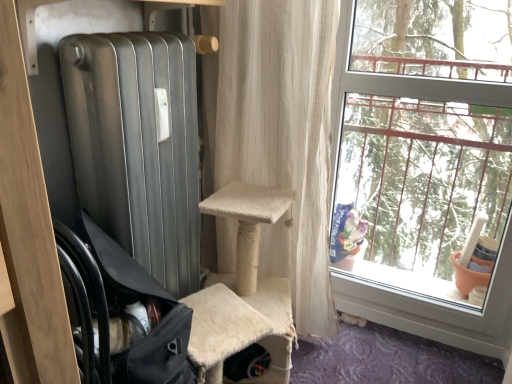
The width and height of the screenshot is (512, 384). I want to click on black fabric chair at left, so click(x=128, y=312).

What is the approximate height of white textured curtain at center?

The height of white textured curtain at center is 4.15 feet.

The image size is (512, 384). Find the location of `clear glass window at right`. clear glass window at right is located at coordinates (397, 86).

This screenshot has height=384, width=512. Find the location of `black fabric chair at left`. black fabric chair at left is located at coordinates (128, 312).

Considering the relative sizes of white textured curtain at center and clear glass window at right in the image provided, is white textured curtain at center smaller than clear glass window at right?

Incorrect, white textured curtain at center is not smaller in size than clear glass window at right.

In order to click on curtain below the clear glass window at right (from a real-world perspective) in this screenshot , I will do `click(279, 133)`.

Based on the photo, choose the correct answer: Is white textured curtain at center inside clear glass window at right or outside it?

white textured curtain at center is not inside clear glass window at right, it's outside.

Between white textured curtain at center and clear glass window at right, which one has less height?

white textured curtain at center.

Is there a large distance between clear glass window at right and white textured curtain at center?

No, there isn't a large distance between clear glass window at right and white textured curtain at center.

How many degrees apart are the facing directions of clear glass window at right and white textured curtain at center?

There is a 0.349-degree angle between the facing directions of clear glass window at right and white textured curtain at center.

From a real-world perspective, who is located lower, clear glass window at right or white textured curtain at center?

In real-world perspective, white textured curtain at center is lower.

Is clear glass window at right further to the viewer compared to white textured curtain at center?

No, it is in front of white textured curtain at center.

Is white textured curtain at center a part of black fabric chair at left?

No.

From the image's perspective, who appears lower, black fabric chair at left or white textured curtain at center?

black fabric chair at left appears lower in the image.

Who is bigger, black fabric chair at left or white textured curtain at center?

With larger size is white textured curtain at center.

What's the angular difference between black fabric chair at left and white textured curtain at center's facing directions?

The facing directions of black fabric chair at left and white textured curtain at center are 91 degrees apart.

Between point (478, 317) and point (146, 312), which one is positioned behind?

The point (478, 317) is behind.

Which object is positioned more to the right, clear glass window at right or black fabric chair at left?

clear glass window at right is more to the right.

Is clear glass window at right taller than black fabric chair at left?

Yes.

Measure the distance from black fabric chair at left to clear glass window at right.

black fabric chair at left and clear glass window at right are 3.67 feet apart.

Which point is more distant from viewer, (x=125, y=305) or (x=385, y=299)?

The point (x=385, y=299) is more distant.

From the image's perspective, is black fabric chair at left on clear glass window at right?

No, from the image's perspective, black fabric chair at left is not on top of clear glass window at right.

From a real-world perspective, is black fabric chair at left located beneath clear glass window at right?

Yes, from a real-world perspective, black fabric chair at left is beneath clear glass window at right.

Is white textured curtain at center inside or outside of black fabric chair at left?

The correct answer is: outside.

Between white textured curtain at center and black fabric chair at left, which one has less height?

With less height is black fabric chair at left.

Considering the positions of objects white textured curtain at center and black fabric chair at left in the image provided, who is more to the right, white textured curtain at center or black fabric chair at left?

Positioned to the right is white textured curtain at center.

In the scene shown: From the image's perspective, is white textured curtain at center on black fabric chair at left?

Yes, from the image's perspective, white textured curtain at center is above black fabric chair at left.

You are a GUI agent. You are given a task and a screenshot of the screen. Output one action in this format:
    pyautogui.click(x=<x>, y=<y>)
    Task: Click on the window above the white textured curtain at center (from a real-world perspective)
    Image resolution: width=512 pixels, height=384 pixels.
    Given the screenshot: What is the action you would take?
    pyautogui.click(x=397, y=86)

Locate an element on the screen. The image size is (512, 384). window below the white textured curtain at center (from the image's perspective) is located at coordinates (397, 86).

Looking at the image, which one is located further to clear glass window at right, white textured curtain at center or black fabric chair at left?

black fabric chair at left is positioned further to the anchor clear glass window at right.

Consider the image. When comparing their distances from white textured curtain at center, does black fabric chair at left or clear glass window at right seem further?

black fabric chair at left.

Considering their positions, is white textured curtain at center positioned closer to black fabric chair at left than clear glass window at right?

Based on the image, white textured curtain at center appears to be nearer to black fabric chair at left.

When comparing their distances from clear glass window at right, does black fabric chair at left or white textured curtain at center seem closer?

white textured curtain at center is closer to clear glass window at right.

From the image, which object appears to be farther from white textured curtain at center, clear glass window at right or black fabric chair at left?

black fabric chair at left is further to white textured curtain at center.

When comparing their distances from black fabric chair at left, does clear glass window at right or white textured curtain at center seem further?

clear glass window at right is positioned further to the anchor black fabric chair at left.

Image resolution: width=512 pixels, height=384 pixels. I want to click on curtain located between black fabric chair at left and clear glass window at right in the left-right direction, so click(x=279, y=133).